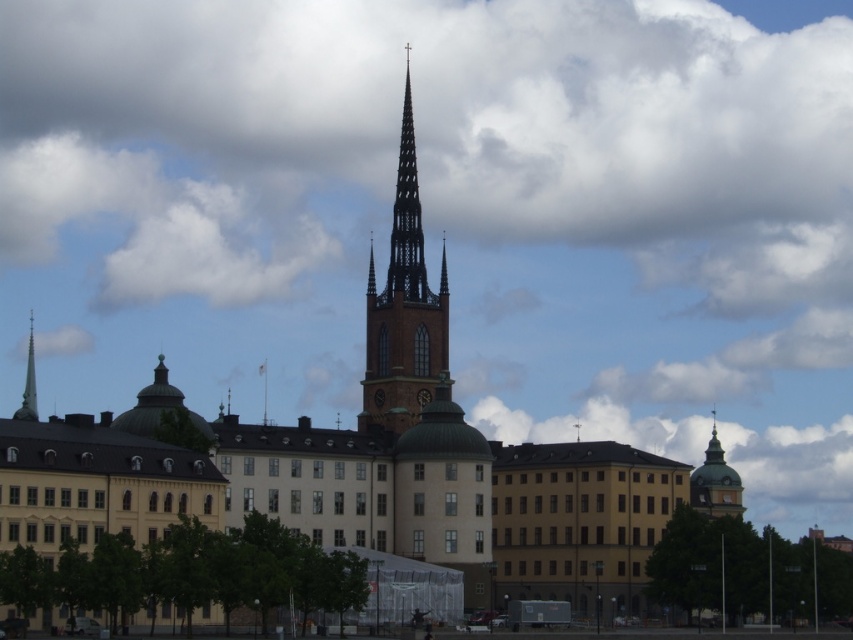
Is brown stone bell tower at center further to the viewer compared to smooth silver spire at left?

Yes, brown stone bell tower at center is further from the viewer.

Is brown stone bell tower at center shorter than smooth silver spire at left?

No, brown stone bell tower at center is not shorter than smooth silver spire at left.

Does point (405, 65) come farther from viewer compared to point (26, 372)?

No, (405, 65) is in front of (26, 372).

The height and width of the screenshot is (640, 853). Find the location of `brown stone bell tower at center`. brown stone bell tower at center is located at coordinates (403, 308).

Looking at this image, does green domed tower at upper right appear under smooth silver spire at left?

Yes, green domed tower at upper right is below smooth silver spire at left.

Which is above, green domed tower at upper right or smooth silver spire at left?

smooth silver spire at left

This screenshot has width=853, height=640. Identify the location of green domed tower at upper right. (715, 483).

Find the location of `green domed tower at upper right`. green domed tower at upper right is located at coordinates (715, 483).

Is brown stone bell tower at center positioned in front of dark brown wooden clock at center?

Yes, brown stone bell tower at center is in front of dark brown wooden clock at center.

Locate an element on the screen. This screenshot has height=640, width=853. brown stone bell tower at center is located at coordinates (403, 308).

Consider the image. Measure the distance between point (389, 323) and camera.

Point (389, 323) is 143.30 meters away from camera.

Identify the location of brown stone bell tower at center. (403, 308).